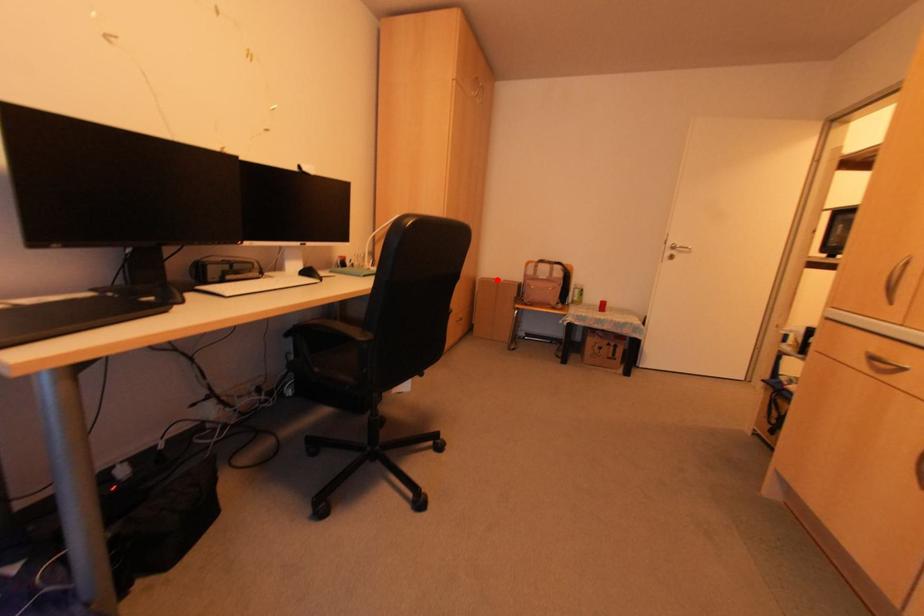
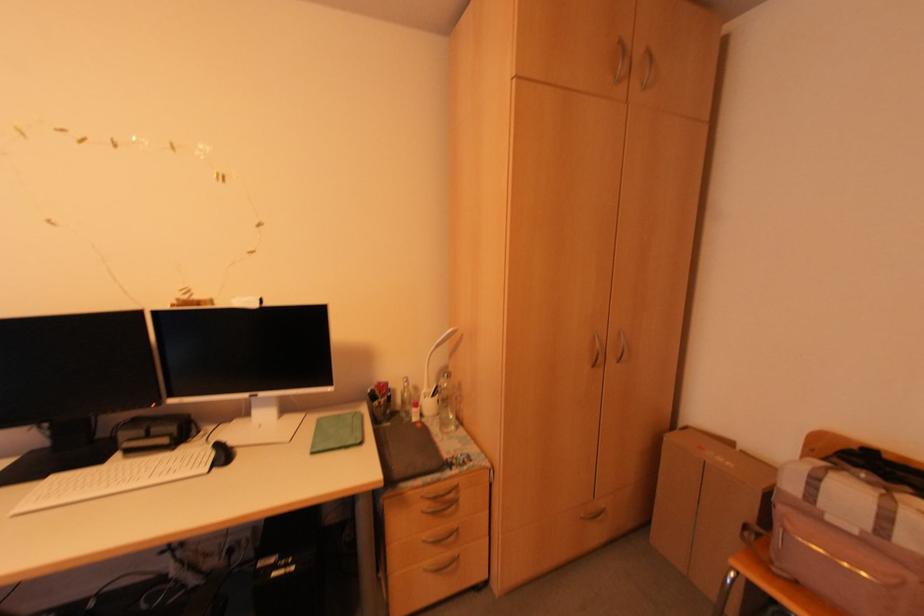
Find the pixel in the second image that matches the highlighted location in the first image.

(728, 444)